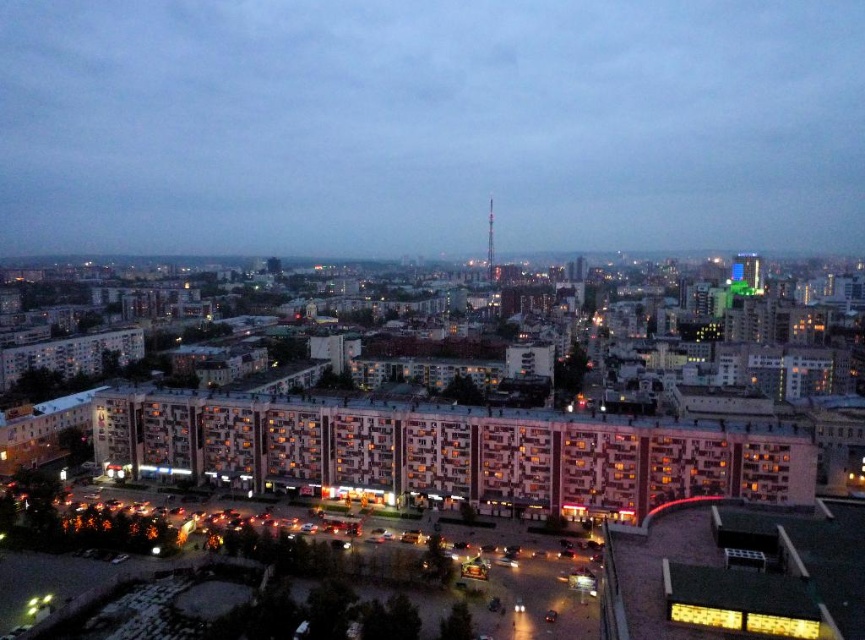
Which is behind, point (516, 100) or point (487, 256)?

Positioned behind is point (516, 100).

Does point (819, 211) come farther from viewer compared to point (487, 246)?

Yes, it is behind point (487, 246).

The width and height of the screenshot is (865, 640). Identify the location of smooth concrete tower at center. (428, 124).